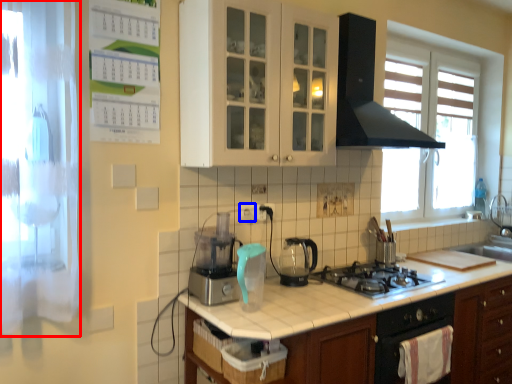
Question: Which object appears closest to the camera in this image, screen door (highlighted by a red box) or electric outlet (highlighted by a blue box)?

Choices:
 (A) screen door
 (B) electric outlet

Answer: (A)